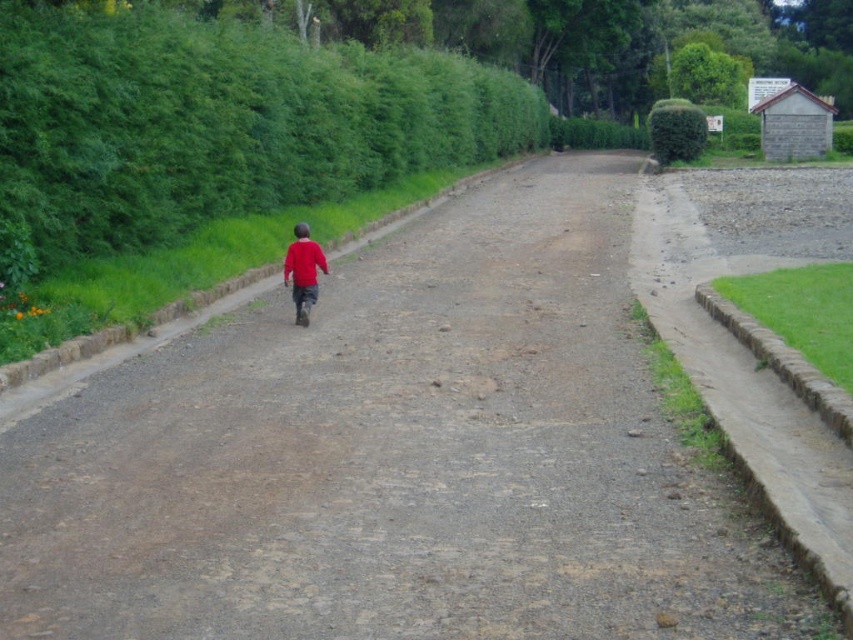
Is green leafy hedge at upper left further to camera compared to red matte shirt at center?

No, green leafy hedge at upper left is closer to the viewer.

Is green leafy hedge at upper left bigger than red matte shirt at center?

Yes.

Is point (242, 200) positioned behind point (299, 291)?

Yes, it is.

I want to click on green leafy hedge at upper left, so click(222, 124).

Image resolution: width=853 pixels, height=640 pixels. What do you see at coordinates (676, 131) in the screenshot?
I see `green leafy hedge at upper right` at bounding box center [676, 131].

How distant is green leafy hedge at upper right from red matte shirt at center?

green leafy hedge at upper right and red matte shirt at center are 38.05 meters apart.

Who is more forward, (686, 147) or (317, 291)?

Point (317, 291) is more forward.

The width and height of the screenshot is (853, 640). What are the coordinates of `green leafy hedge at upper right` in the screenshot? It's located at (676, 131).

Between green leafy hedge at upper left and green leafy hedge at upper right, which one has less height?

With less height is green leafy hedge at upper left.

Does green leafy hedge at upper left have a lesser width compared to green leafy hedge at upper right?

Indeed, green leafy hedge at upper left has a lesser width compared to green leafy hedge at upper right.

Locate an element on the screen. green leafy hedge at upper left is located at coordinates (222, 124).

This screenshot has width=853, height=640. What are the coordinates of `green leafy hedge at upper left` in the screenshot? It's located at (222, 124).